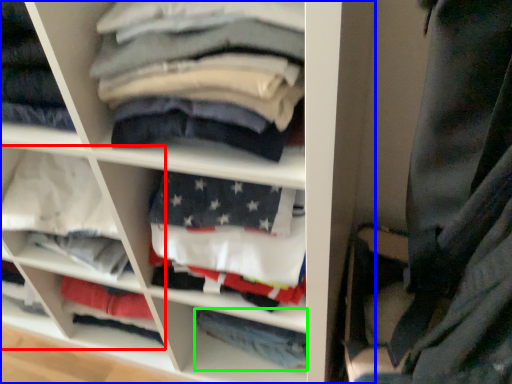
Question: Which object is the closest to the cabinet (highlighted by a red box)? Choose among these: shelf (highlighted by a blue box) or trousers (highlighted by a green box).

Choices:
 (A) shelf
 (B) trousers

Answer: (A)